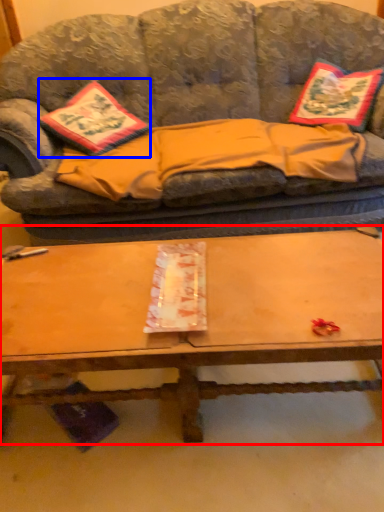
Question: Among these objects, which one is nearest to the camera, coffee table (highlighted by a red box) or throw pillow (highlighted by a blue box)?

Choices:
 (A) coffee table
 (B) throw pillow

Answer: (A)